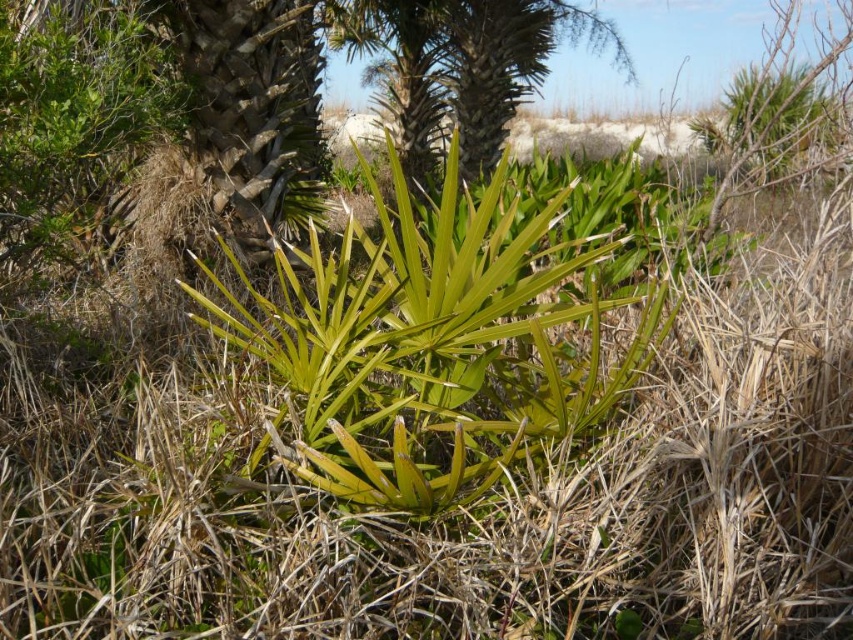
Can you confirm if green leafy plant at center is positioned to the right of green leafy palm tree at center?

Indeed, green leafy plant at center is positioned on the right side of green leafy palm tree at center.

Consider the image. Is green leafy plant at center above green leafy palm tree at center?

No.

Does point (515, 244) lie behind point (347, 51)?

No, it is in front of (347, 51).

The width and height of the screenshot is (853, 640). What are the coordinates of `green leafy plant at center` in the screenshot? It's located at (430, 348).